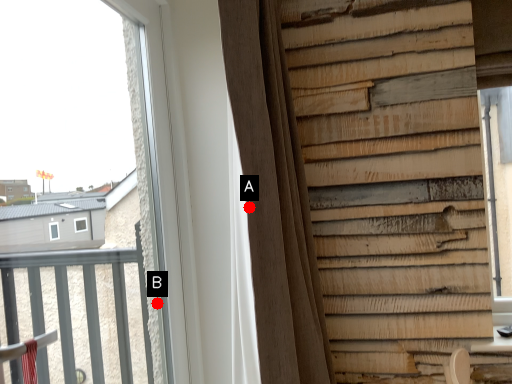
Question: Two points are circled on the image, labeled by A and B beside each circle. Which point is closer to the camera?

Choices:
 (A) A is closer
 (B) B is closer

Answer: (A)